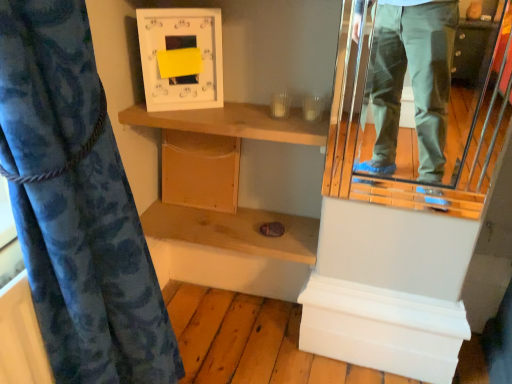
Question: Choose the correct answer: Is wooden shelf at upper center, acting as the 2th shelf starting from the bottom, inside blue floral fabric at left or outside it?

Choices:
 (A) inside
 (B) outside

Answer: (B)

Question: Considering their positions, is wooden shelf at upper center, acting as the 2th shelf starting from the bottom, located in front of or behind blue floral fabric at left?

Choices:
 (A) front
 (B) behind

Answer: (B)

Question: Which is farther from the blue floral fabric at left?

Choices:
 (A) metallic reflective mirror at right
 (B) wooden shelf at upper center, acting as the 2th shelf starting from the bottom
 (C) wooden shelf at center, acting as the second shelf starting from the top
 (D) wooden cabinet at center

Answer: (A)

Question: Estimate the real-world distances between objects in this image. Which object is farther from the metallic reflective mirror at right?

Choices:
 (A) wooden shelf at center, acting as the second shelf starting from the top
 (B) wooden shelf at upper center, acting as the 2th shelf starting from the bottom
 (C) blue floral fabric at left
 (D) wooden cabinet at center

Answer: (C)